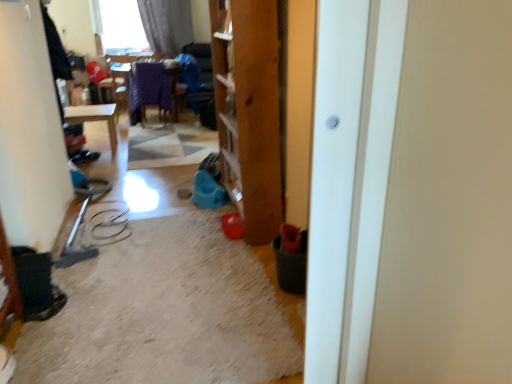
Where is `matte gray curtain at upper left`? This screenshot has width=512, height=384. matte gray curtain at upper left is located at coordinates (167, 25).

Describe the element at coordinates (167, 25) in the screenshot. The width and height of the screenshot is (512, 384). I see `matte gray curtain at upper left` at that location.

This screenshot has width=512, height=384. What do you see at coordinates (337, 176) in the screenshot?
I see `white glossy door at center` at bounding box center [337, 176].

Measure the distance between point (336, 16) and camera.

The distance of point (336, 16) from camera is 1.03 meters.

At what (x,y) coordinates should I click in order to perform the action: click on white glossy door at center. Please return your answer as a coordinate pair (x, y). This screenshot has width=512, height=384. Looking at the image, I should click on (337, 176).

Where is `matte gray curtain at upper left`? The width and height of the screenshot is (512, 384). matte gray curtain at upper left is located at coordinates (167, 25).

Can you confirm if white glossy door at center is positioned to the left of matte gray curtain at upper left?

Incorrect, white glossy door at center is not on the left side of matte gray curtain at upper left.

Looking at this image, does white glossy door at center come in front of matte gray curtain at upper left?

Yes, it is in front of matte gray curtain at upper left.

Does point (355, 234) come farther from viewer compared to point (141, 12)?

No, it is not.

Looking at this image, from the image's perspective, relative to matte gray curtain at upper left, is white glossy door at center above or below?

From the image's perspective, white glossy door at center appears below matte gray curtain at upper left.

From a real-world perspective, between white glossy door at center and matte gray curtain at upper left, who is vertically lower?

In real-world perspective, white glossy door at center is lower.

Between white glossy door at center and matte gray curtain at upper left, which one has larger width?

white glossy door at center is wider.

Who is taller, white glossy door at center or matte gray curtain at upper left?

white glossy door at center.

Is white glossy door at center bigger than matte gray curtain at upper left?

Incorrect, white glossy door at center is not larger than matte gray curtain at upper left.

Which is correct: white glossy door at center is inside matte gray curtain at upper left, or outside of it?

white glossy door at center cannot be found inside matte gray curtain at upper left.

Is white glossy door at center far away from matte gray curtain at upper left?

That's right, there is a large distance between white glossy door at center and matte gray curtain at upper left.

Is white glossy door at center facing towards matte gray curtain at upper left?

No, white glossy door at center does not turn towards matte gray curtain at upper left.

Based on the photo, what's the angular difference between white glossy door at center and matte gray curtain at upper left's facing directions?

The facing directions of white glossy door at center and matte gray curtain at upper left are 0.374 degrees apart.

Image resolution: width=512 pixels, height=384 pixels. Find the location of `curtain above the white glossy door at center (from the image's perspective)`. curtain above the white glossy door at center (from the image's perspective) is located at coordinates (167, 25).

Which is more to the right, matte gray curtain at upper left or white glossy door at center?

white glossy door at center is more to the right.

Which object is closer to the camera taking this photo, matte gray curtain at upper left or white glossy door at center?

white glossy door at center is in front.

Which is behind, point (163, 5) or point (336, 88)?

The point (163, 5) is farther from the camera.

From the image's perspective, is matte gray curtain at upper left positioned above or below white glossy door at center?

Based on their image positions, matte gray curtain at upper left is located above white glossy door at center.

From a real-world perspective, who is located lower, matte gray curtain at upper left or white glossy door at center?

From a 3D spatial view, white glossy door at center is below.

Which of these two, matte gray curtain at upper left or white glossy door at center, is wider?

white glossy door at center is wider.

Considering the sizes of objects matte gray curtain at upper left and white glossy door at center in the image provided, who is taller, matte gray curtain at upper left or white glossy door at center?

With more height is white glossy door at center.

From the picture: Is matte gray curtain at upper left bigger or smaller than white glossy door at center?

Considering their sizes, matte gray curtain at upper left takes up more space than white glossy door at center.

Based on the photo, is matte gray curtain at upper left inside the boundaries of white glossy door at center, or outside?

matte gray curtain at upper left exists outside the volume of white glossy door at center.

Are matte gray curtain at upper left and white glossy door at center located far from each other?

Yes, matte gray curtain at upper left and white glossy door at center are located far from each other.

Is matte gray curtain at upper left looking in the opposite direction of white glossy door at center?

No.

How many degrees apart are the facing directions of matte gray curtain at upper left and white glossy door at center?

The facing directions of matte gray curtain at upper left and white glossy door at center are 0.374 degrees apart.

This screenshot has height=384, width=512. Identify the location of curtain on the left of white glossy door at center. (167, 25).

Where is `curtain on the left of the white glossy door at center`? This screenshot has height=384, width=512. curtain on the left of the white glossy door at center is located at coordinates (167, 25).

Locate an element on the screen. Image resolution: width=512 pixels, height=384 pixels. screen door in front of the matte gray curtain at upper left is located at coordinates pos(337,176).